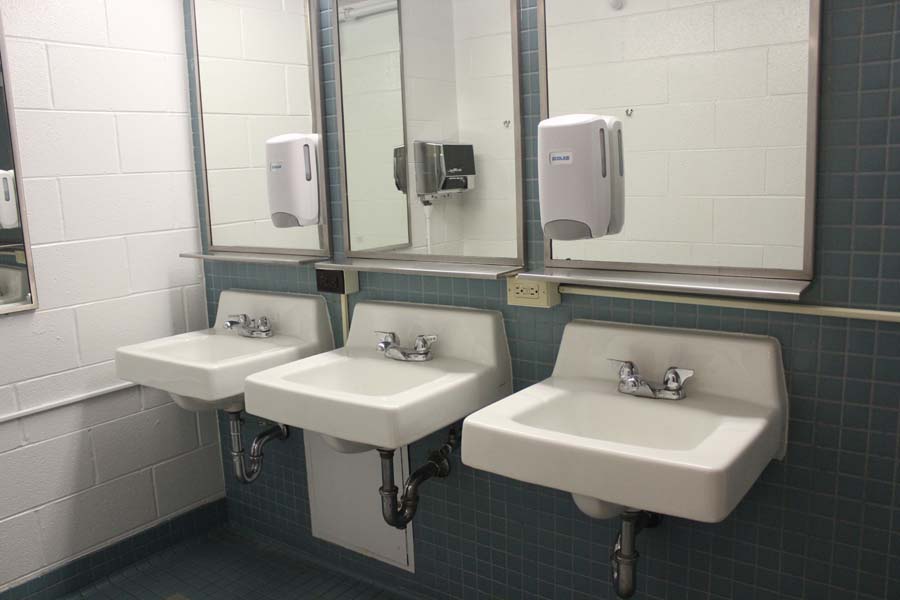
Find the location of a particular element. soap dispenser is located at coordinates (559, 190), (285, 179).